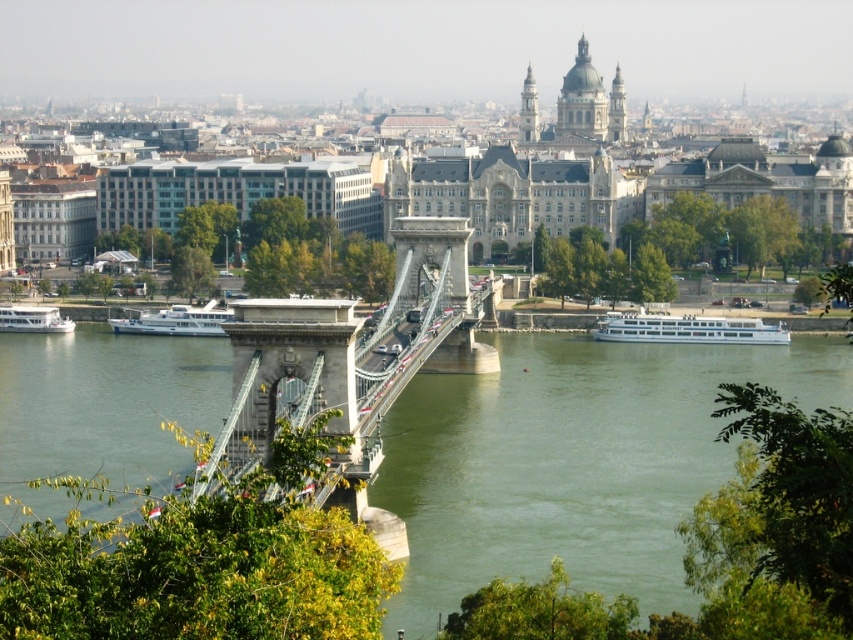
Question: Which object appears farthest from the camera in this image?

Choices:
 (A) white glossy boat at center
 (B) metallic chain-link bridge at center
 (C) white glossy boat at lower left

Answer: (C)

Question: Which object is positioned farthest from the greenish water at center?

Choices:
 (A) white glossy boat at lower right
 (B) white glossy boat at center

Answer: (B)

Question: Does metallic chain-link bridge at center have a lesser width compared to white glossy boat at lower left?

Choices:
 (A) no
 (B) yes

Answer: (A)

Question: Estimate the real-world distances between objects in this image. Which object is closer to the white glossy boat at lower right?

Choices:
 (A) metallic chain-link bridge at center
 (B) white glossy boat at center
 (C) greenish water at center

Answer: (C)

Question: Can you confirm if greenish water at center is smaller than white glossy boat at center?

Choices:
 (A) yes
 (B) no

Answer: (B)

Question: Can you confirm if metallic chain-link bridge at center is positioned to the left of white glossy boat at center?

Choices:
 (A) no
 (B) yes

Answer: (A)